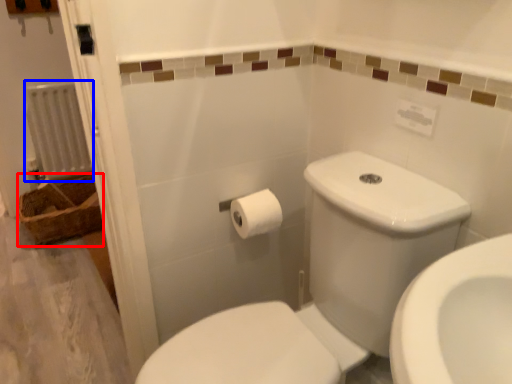
Question: Among these objects, which one is farthest to the camera, basket (highlighted by a red box) or radiator (highlighted by a blue box)?

Choices:
 (A) basket
 (B) radiator

Answer: (B)